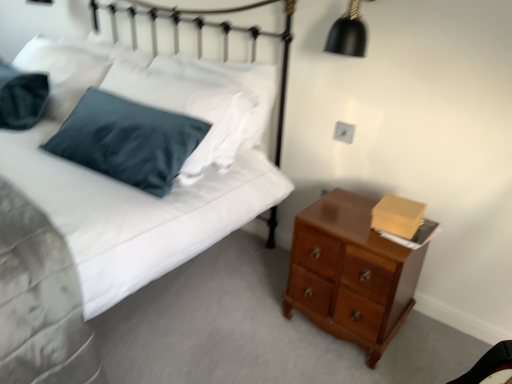
What are the coordinates of `free space in front of glossy wood chest of drawers at lower right` in the screenshot? It's located at (349, 364).